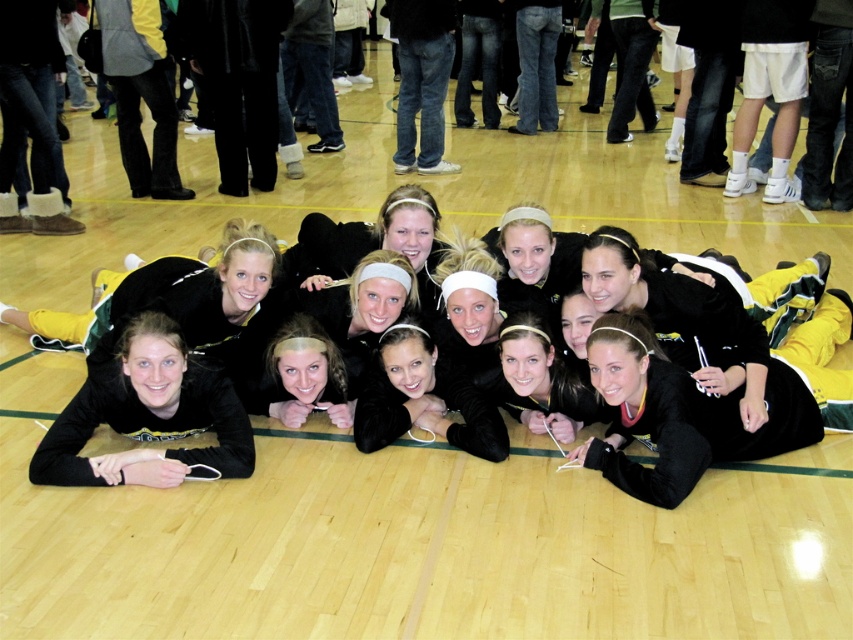
In the scene shown: You are a photographer trying to capture a closeup shot of the black matte headband at center and the matte black headband at center. Which one is positioned lower in the image?

The black matte headband at center is positioned lower than the matte black headband at center in the image.

You are a photographer trying to capture a closeup shot of the black matte headband at center and the matte black headband at center. Given that your camera has a maximum focus range of 50 centimeters, will you be able to focus on both headbands simultaneously?

The black matte headband at center is 58.92 centimeters away from the matte black headband at center. Since the distance between them exceeds the camera maximum focus range of 50 centimeters, you cannot focus on both simultaneously.

You are a photographer trying to capture a closeup of the black matte headband at center and the matte black headband at center. Which headband appears taller in the photo?

The black matte headband at center appears taller in the photo because it is much taller than the matte black headband at center according to the description.